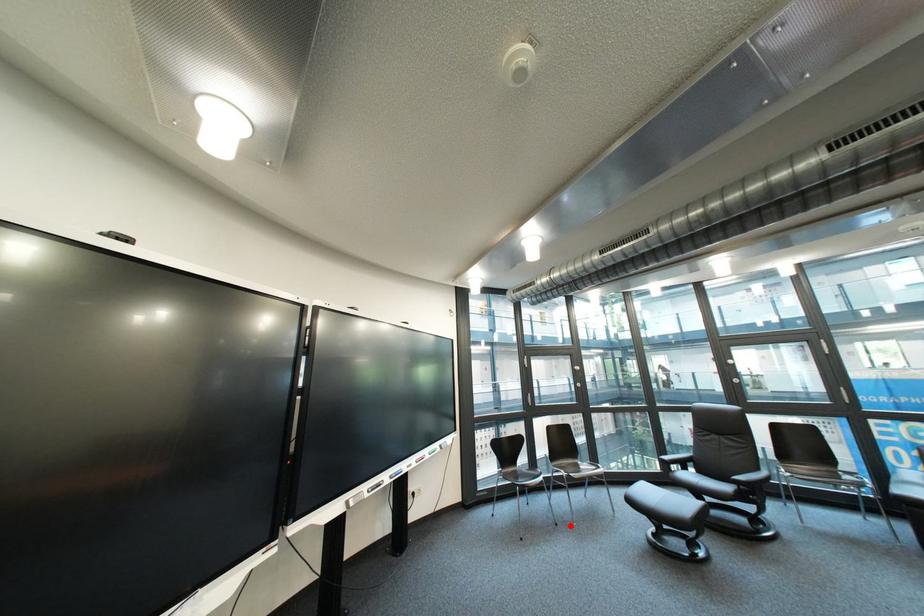
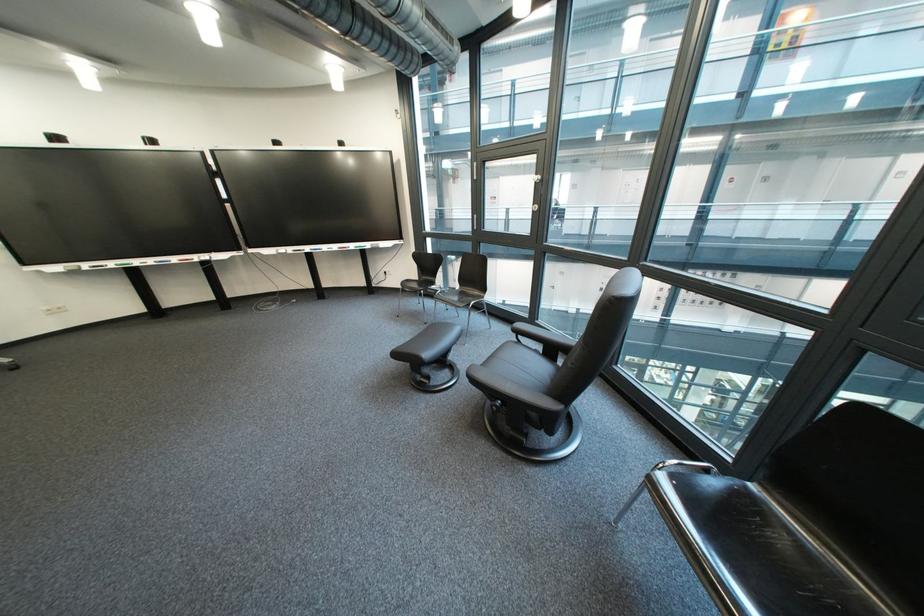
Question: I am providing you with two images of the same scene from different viewpoints. In image1, a red point is highlighted. Considering the same 3D point in image2, which of the following is correct?

Choices:
 (A) It is closer
 (B) It is farther

Answer: (A)